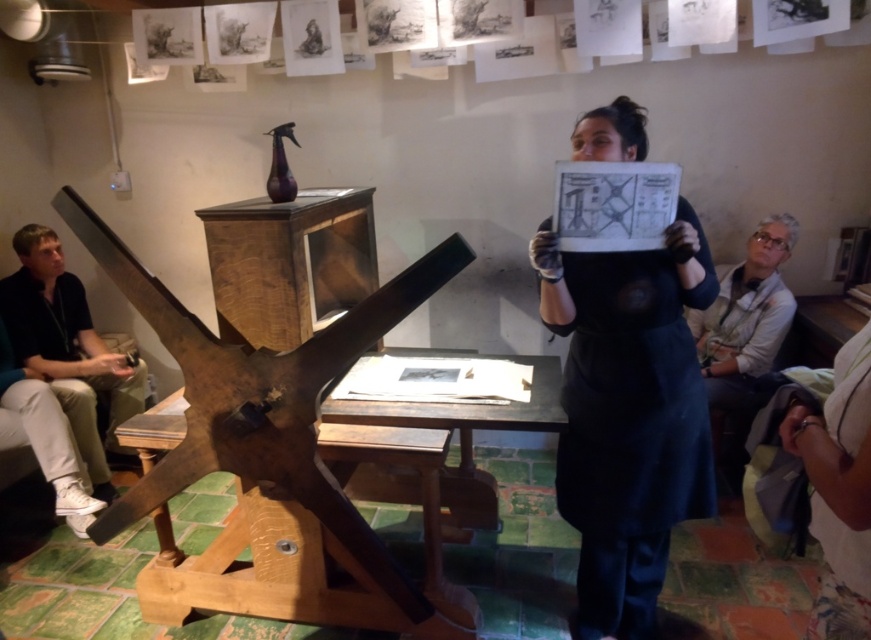
You are organizing a small event in this workshop and need to place a 1.2 meter wide table between the rusty wood easel at center and the white shirt at right. Can the table fit between them based on their widths?

The rusty wood easel at center is wider than the white shirt at right. However, since the table is 1.2 meters wide, we need to know the exact width of the space between them. Unfortunately, the provided information only states that the easel is wider than the shirt but does not specify the distance between them. Therefore, it is impossible to determine if the table will fit without additional measurements.

You are a photographer standing in the workshop and want to take a photo of the rusty wood easel at center. Your camera has a minimum focusing distance of 1.5 meters. Can you take the photo without moving either the camera or the easel?

The rusty wood easel at center and camera are 1.75 meters apart. Since the minimum focusing distance is 1.5 meters, you can take the photo without moving either the camera or the easel because the distance is sufficient.

You are an interior designer observing the indoor setting. You notice the rusty wood easel at center and the black matte dress at center. Which object is located below the other?

The rusty wood easel at center is positioned under the black matte dress at center, meaning the easel is below the dress.